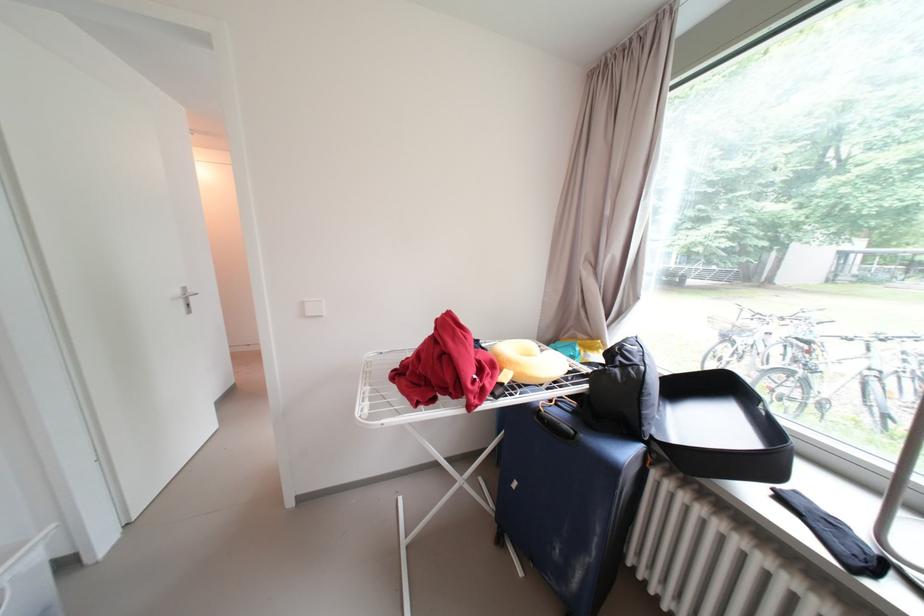
Where would you lift the yellow neck pillow? Please return your answer as a coordinate pair (x, y).

(529, 361)